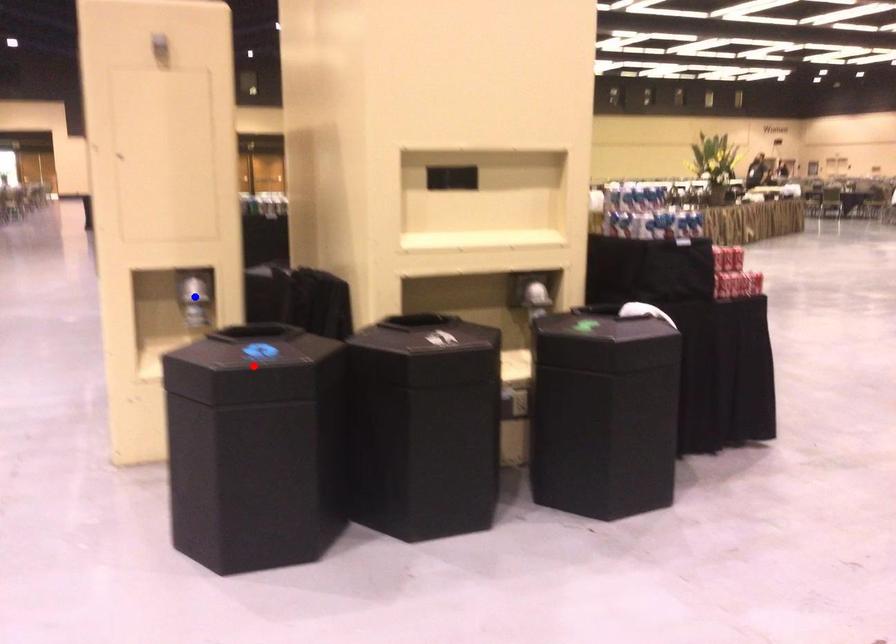
Question: Two points are marked on the image. Which point is closer to the camera?

Choices:
 (A) Blue point is closer.
 (B) Red point is closer.

Answer: (B)